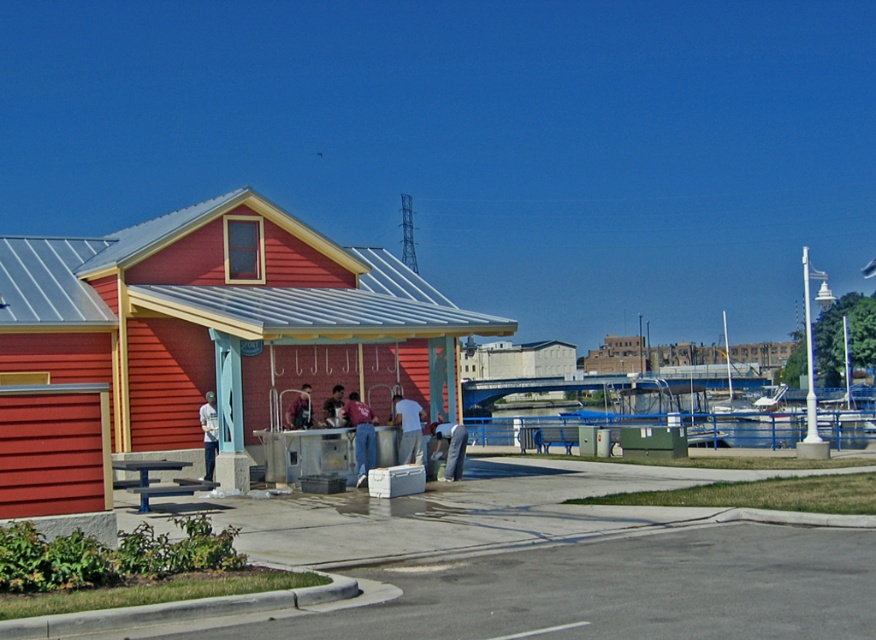
Question: Based on their relative distances, which object is farther from the denim jacket at left?

Choices:
 (A) white matte shirt at center
 (B) matte red shirt at center
 (C) matte red wooden beach hut at center
 (D) denim jacket at center

Answer: (A)

Question: Is the position of transparent blue water at lower center less distant than that of matte red shirt at center?

Choices:
 (A) yes
 (B) no

Answer: (B)

Question: Based on their relative distances, which object is farther from the denim jacket at left?

Choices:
 (A) denim jacket at center
 (B) matte red wooden beach hut at center
 (C) matte red shirt at center

Answer: (C)

Question: Is matte red wooden beach hut at center above matte red shirt at center?

Choices:
 (A) no
 (B) yes

Answer: (B)

Question: Can you confirm if matte red wooden beach hut at center is positioned below denim jacket at left?

Choices:
 (A) no
 (B) yes

Answer: (A)

Question: Which is nearer to the matte red wooden beach hut at center?

Choices:
 (A) transparent blue water at lower center
 (B) gray fabric pants at center
 (C) matte red shirt at center

Answer: (C)